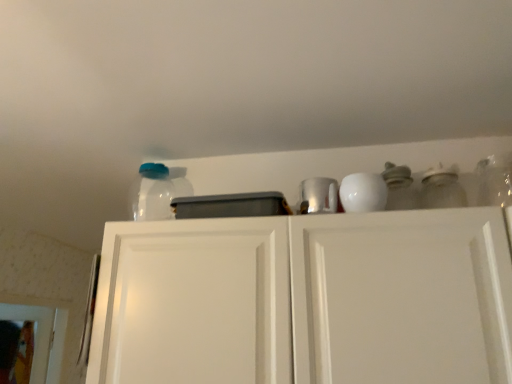
Question: From the image's perspective, is shiny metallic cup at upper center above white matte cabinet doors at upper center?

Choices:
 (A) yes
 (B) no

Answer: (A)

Question: Considering the relative sizes of shiny metallic cup at upper center and white matte cabinet doors at upper center in the image provided, is shiny metallic cup at upper center thinner than white matte cabinet doors at upper center?

Choices:
 (A) no
 (B) yes

Answer: (B)

Question: From the image's perspective, does shiny metallic cup at upper center appear lower than white matte cabinet doors at upper center?

Choices:
 (A) no
 (B) yes

Answer: (A)

Question: From a real-world perspective, is shiny metallic cup at upper center below white matte cabinet doors at upper center?

Choices:
 (A) no
 (B) yes

Answer: (A)

Question: From a real-world perspective, is shiny metallic cup at upper center physically above white matte cabinet doors at upper center?

Choices:
 (A) no
 (B) yes

Answer: (B)

Question: Is shiny metallic cup at upper center positioned with its back to white matte cabinet doors at upper center?

Choices:
 (A) no
 (B) yes

Answer: (A)

Question: From the image's perspective, would you say shiny metallic cup at upper center is shown under transparent plastic jar at upper left, the 1th glass jar positioned from the left?

Choices:
 (A) no
 (B) yes

Answer: (B)

Question: Is shiny metallic cup at upper center not close to transparent plastic jar at upper left, which is the second glass jar from front to back?

Choices:
 (A) no
 (B) yes

Answer: (A)

Question: Can you confirm if shiny metallic cup at upper center is smaller than transparent plastic jar at upper left, the 1th glass jar positioned from the left?

Choices:
 (A) no
 (B) yes

Answer: (B)

Question: Can you confirm if shiny metallic cup at upper center is positioned to the left of transparent plastic jar at upper left, which appears as the 1th glass jar when viewed from the back?

Choices:
 (A) yes
 (B) no

Answer: (B)

Question: Is the position of shiny metallic cup at upper center more distant than that of transparent plastic jar at upper left, which is the second glass jar from front to back?

Choices:
 (A) yes
 (B) no

Answer: (B)

Question: Can you confirm if shiny metallic cup at upper center is shorter than transparent plastic jar at upper left, the 1th glass jar positioned from the left?

Choices:
 (A) yes
 (B) no

Answer: (A)

Question: Is clear glass jar at upper right, the second glass jar in the back-to-front sequence, taller than white matte cabinet doors at upper center?

Choices:
 (A) no
 (B) yes

Answer: (A)